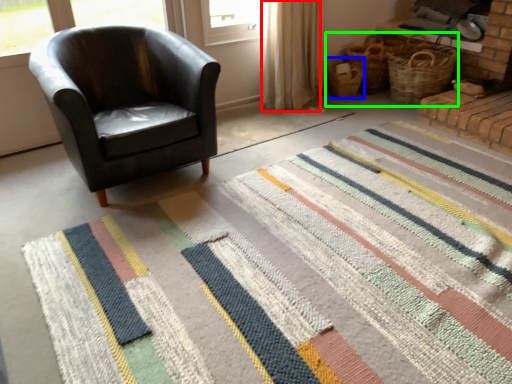
Question: Based on their relative distances, which object is nearer to curtain (highlighted by a red box)? Choose from basket (highlighted by a blue box) and basket (highlighted by a green box).

Choices:
 (A) basket
 (B) basket

Answer: (A)